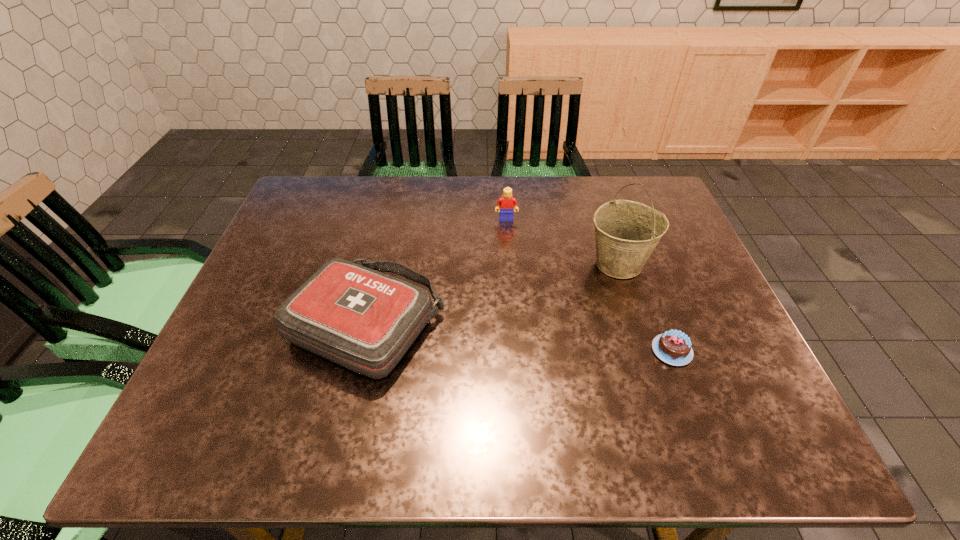
Find the location of a particular element. This screenshot has width=960, height=540. object that is at the left edge is located at coordinates (364, 320).

Where is `wine bucket located at the right edge`? wine bucket located at the right edge is located at coordinates (627, 232).

Locate an element on the screen. The image size is (960, 540). chocolate cake at the right edge is located at coordinates (673, 347).

The width and height of the screenshot is (960, 540). What are the coordinates of `vacant space at the far edge` in the screenshot? It's located at (391, 196).

The width and height of the screenshot is (960, 540). What are the coordinates of `vacant position at the left edge of the desktop` in the screenshot? It's located at (252, 348).

Where is `free space at the right edge of the desktop`? This screenshot has height=540, width=960. free space at the right edge of the desktop is located at coordinates (700, 355).

This screenshot has width=960, height=540. Identify the location of free region at the far right corner of the desktop. (638, 194).

Image resolution: width=960 pixels, height=540 pixels. Identify the location of free point between the Lego and the chocolate cake. point(589,285).

Locate an element on the screen. vacant area between the leftmost object and the wine bucket is located at coordinates (492, 294).

This screenshot has height=540, width=960. Find the location of `vacant area that lies between the wine bucket and the first-aid kit`. vacant area that lies between the wine bucket and the first-aid kit is located at coordinates (492, 294).